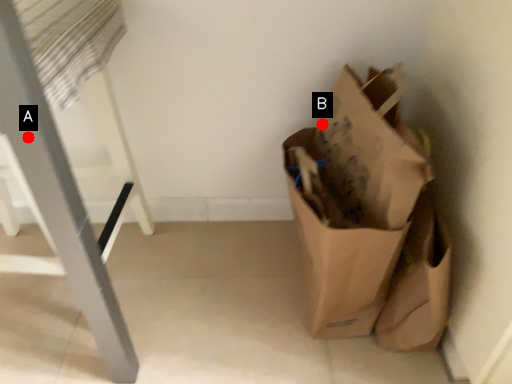
Question: Two points are circled on the image, labeled by A and B beside each circle. Which point is further to the camera?

Choices:
 (A) A is further
 (B) B is further

Answer: (B)